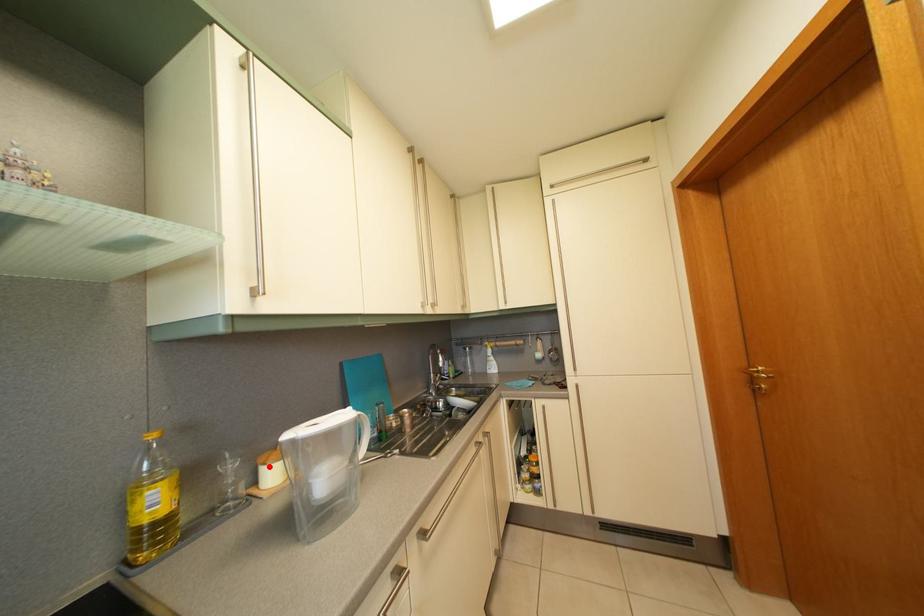
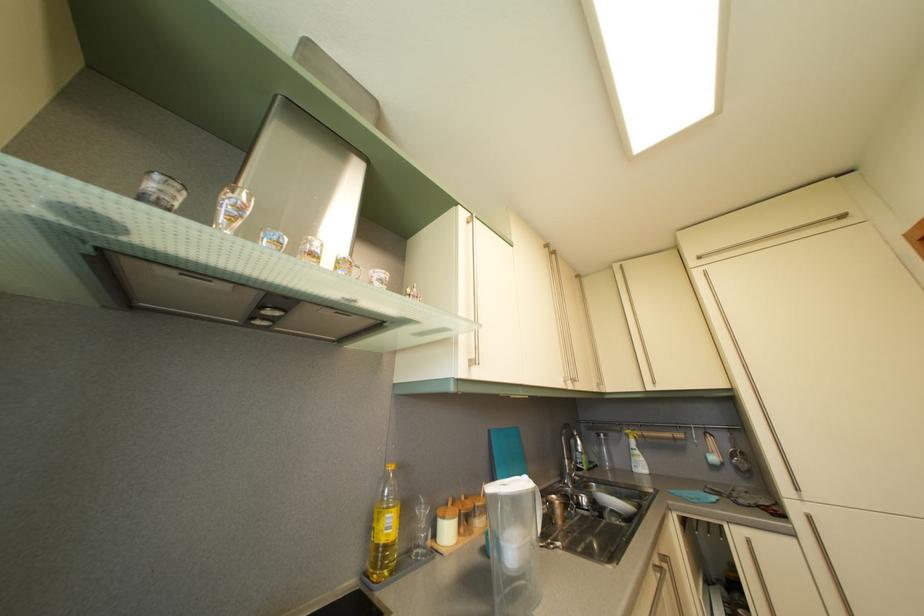
Question: I am providing you with two images of the same scene from different viewpoints. Given a red point in image1, look at the same physical point in image2. Is it:

Choices:
 (A) Closer to the viewpoint
 (B) Farther from the viewpoint

Answer: (A)